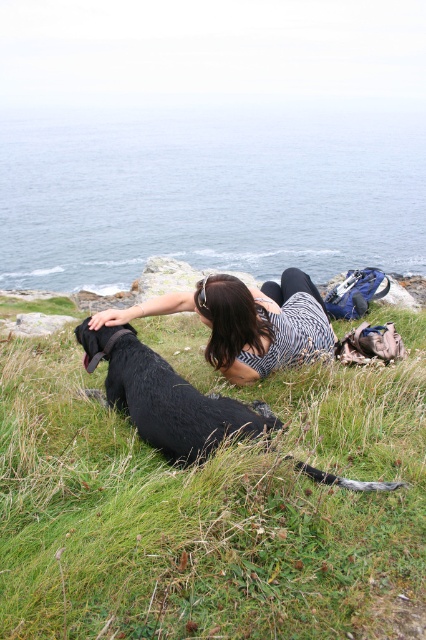
Does shiny black dog at center come behind striped fabric shirt at center?

No, it is not.

Does point (88, 364) come closer to viewer compared to point (218, 364)?

Yes, it is in front of point (218, 364).

Where is `shiny black dog at center`? shiny black dog at center is located at coordinates (166, 397).

Between green grassy at center and striped fabric shirt at center, which one appears on the left side from the viewer's perspective?

From the viewer's perspective, green grassy at center appears more on the left side.

Is green grassy at center smaller than striped fabric shirt at center?

No, green grassy at center is not smaller than striped fabric shirt at center.

Locate an element on the screen. green grassy at center is located at coordinates (212, 502).

Who is positioned more to the right, green grassy at center or shiny black dog at center?

From the viewer's perspective, green grassy at center appears more on the right side.

Who is taller, green grassy at center or shiny black dog at center?

green grassy at center is taller.

Does point (420, 353) come farther from viewer compared to point (193, 444)?

Yes, point (420, 353) is farther from viewer.

The width and height of the screenshot is (426, 640). Find the location of `green grassy at center`. green grassy at center is located at coordinates (212, 502).